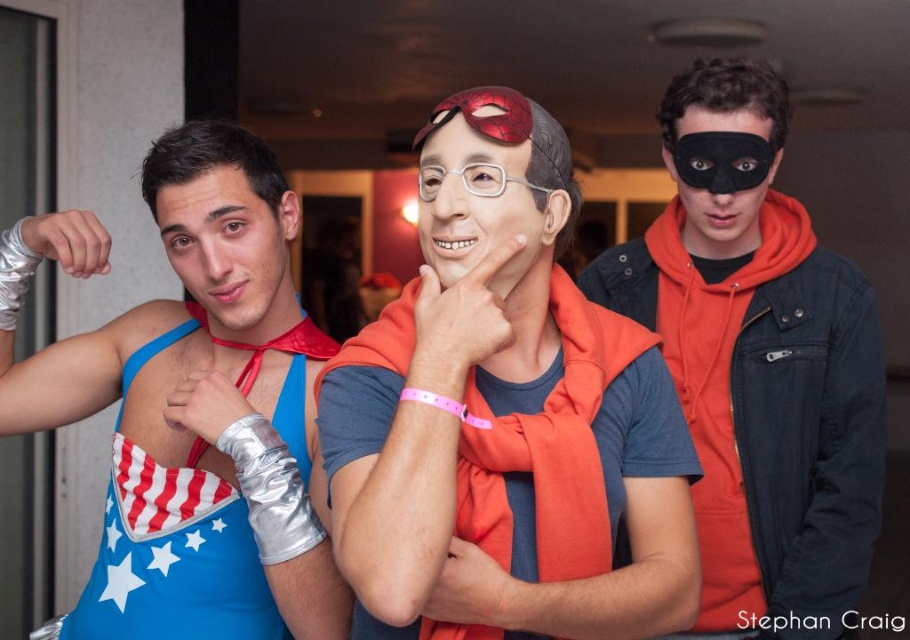
Question: Which of these objects is positioned farthest from the matte red scarf at center?

Choices:
 (A) black matte mask at upper right
 (B) shiny metallic arm at center

Answer: (A)

Question: Observing the image, what is the correct spatial positioning of matte blue tank top at left in reference to black matte mask at center?

Choices:
 (A) below
 (B) above

Answer: (A)

Question: Does black matte mask at upper right have a smaller size compared to matte plastic mask at center?

Choices:
 (A) no
 (B) yes

Answer: (A)

Question: Is matte red scarf at center positioned in front of shiny red goggles at center?

Choices:
 (A) yes
 (B) no

Answer: (A)

Question: Which of the following is the closest to the observer?

Choices:
 (A) black matte mask at upper right
 (B) matte blue tank top at left

Answer: (B)

Question: Which of the following is the farthest from the observer?

Choices:
 (A) matte blue tank top at left
 (B) black matte mask at center
 (C) matte red scarf at center
 (D) shiny red goggles at center

Answer: (B)